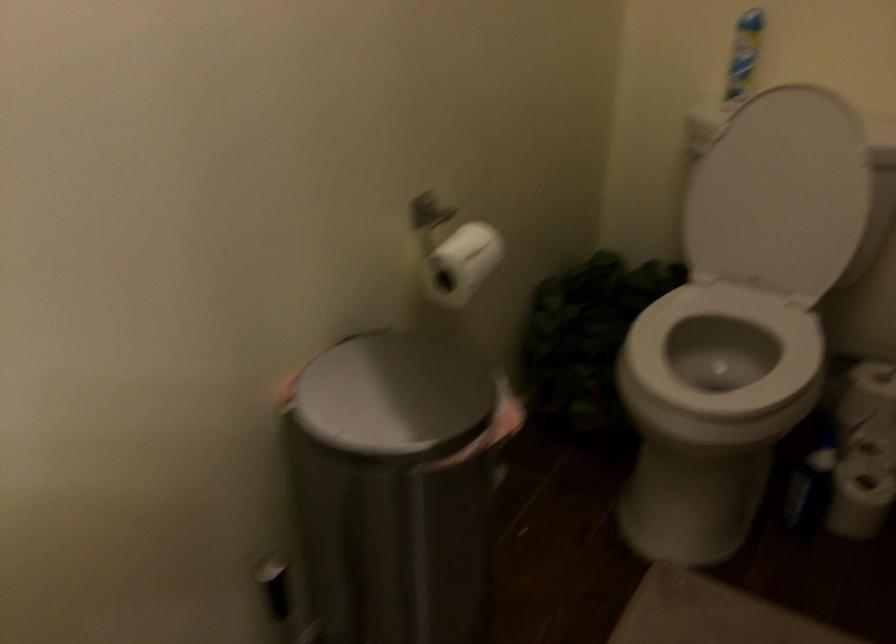
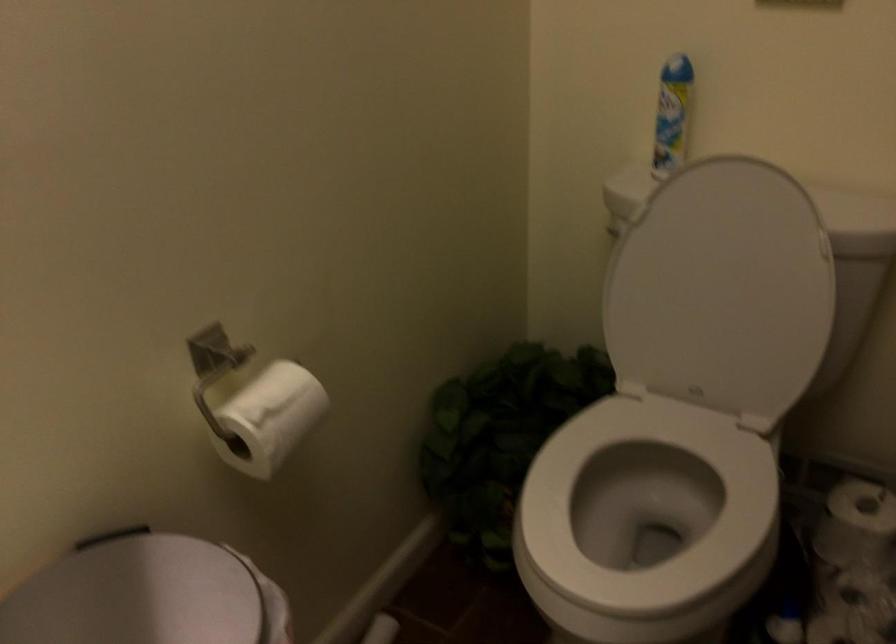
Where in the second image is the point corresponding to [780,194] from the first image?

(721, 289)